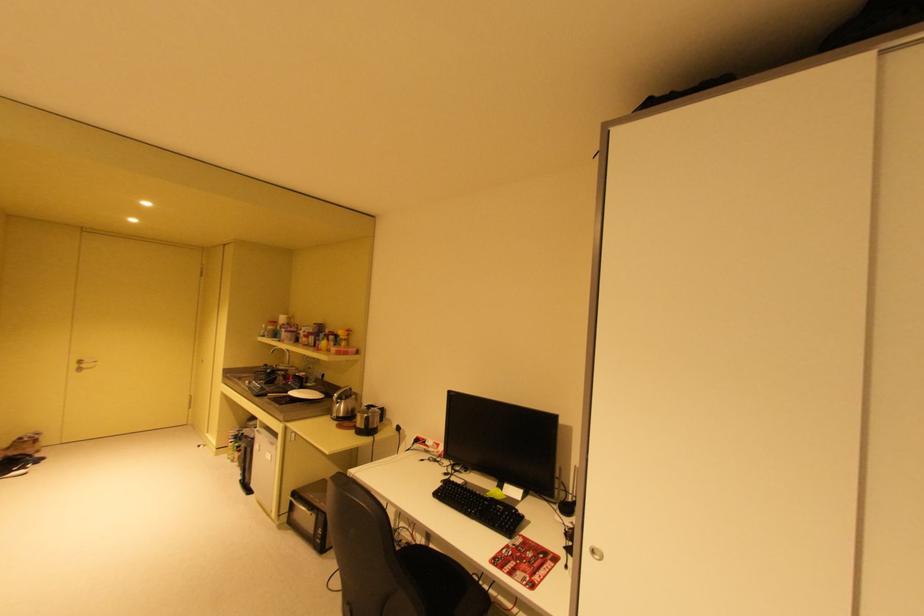
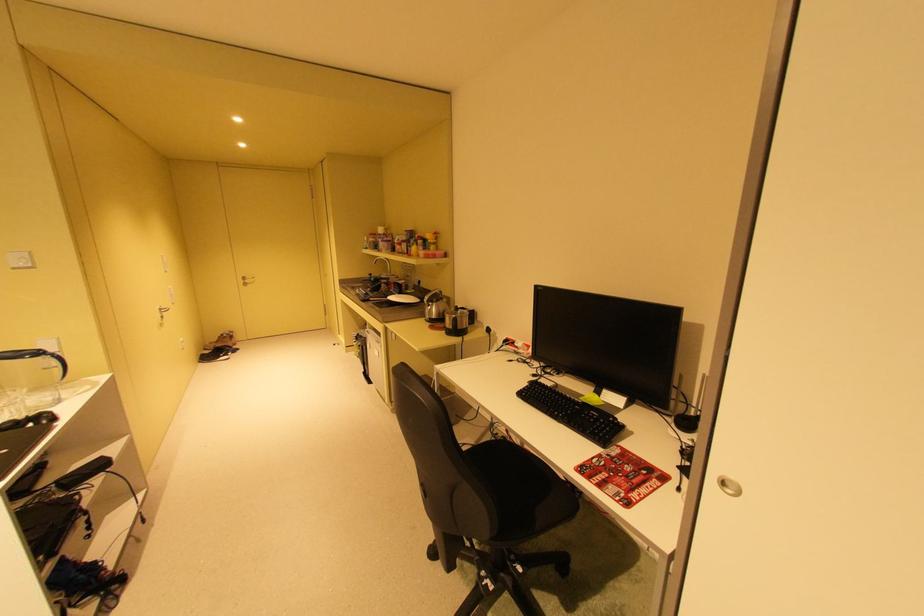
The point at (338,333) is marked in the first image. Where is the corresponding point in the second image?

(428, 237)